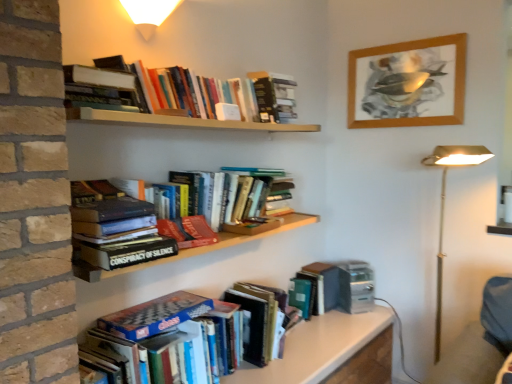
This screenshot has height=384, width=512. In order to click on vacant area on top of green matte book at lower center, which is counted as the second book, starting from the bottom (from a real-world perspective) in this screenshot , I will do `click(315, 269)`.